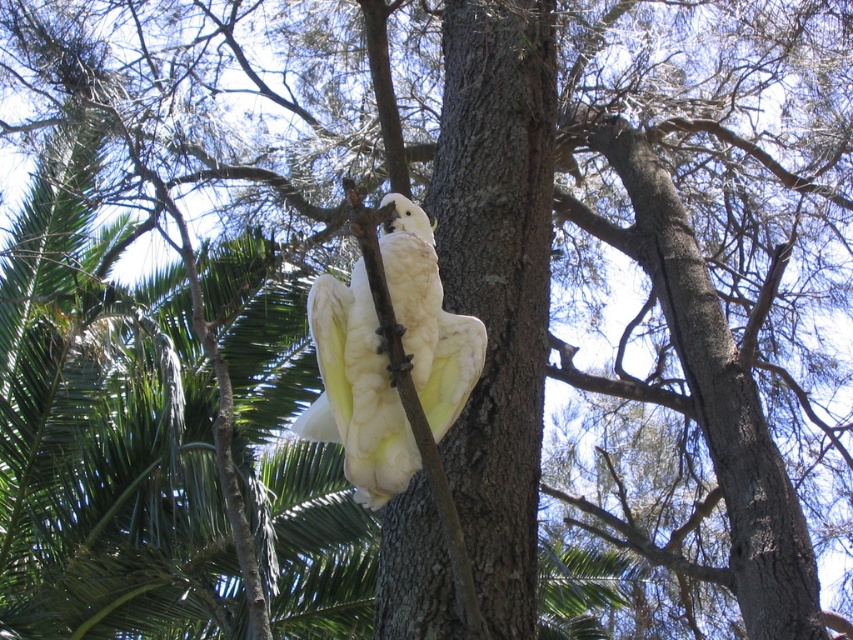
Does brown rough tree trunk at center come in front of white feathered parrot at center?

No.

Find the location of a particular element. brown rough tree trunk at center is located at coordinates (498, 280).

Locate an element on the screen. This screenshot has width=853, height=640. brown rough tree trunk at center is located at coordinates (498, 280).